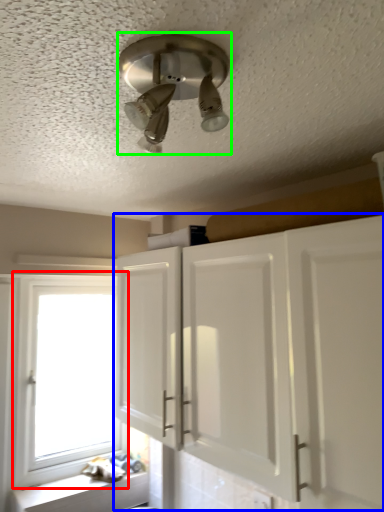
Question: Which object is the closest to the window (highlighted by a red box)? Choose among these: cabinetry (highlighted by a blue box) or light fixture (highlighted by a green box).

Choices:
 (A) cabinetry
 (B) light fixture

Answer: (A)